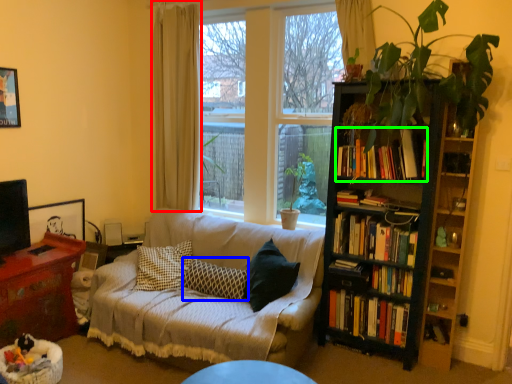
Question: Estimate the real-world distances between objects in this image. Which object is closer to curtain (highlighted by a red box), pillow (highlighted by a blue box) or book (highlighted by a green box)?

Choices:
 (A) pillow
 (B) book

Answer: (A)